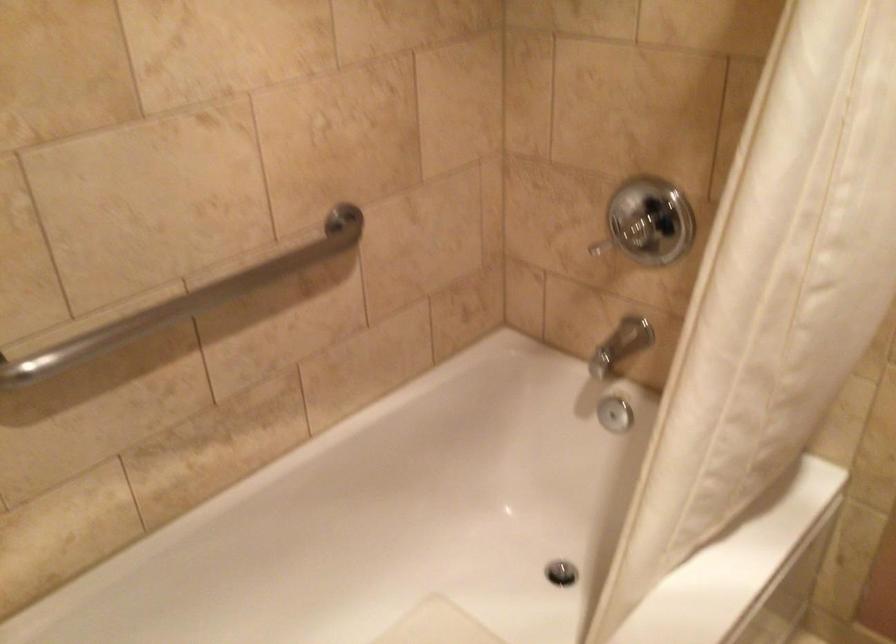
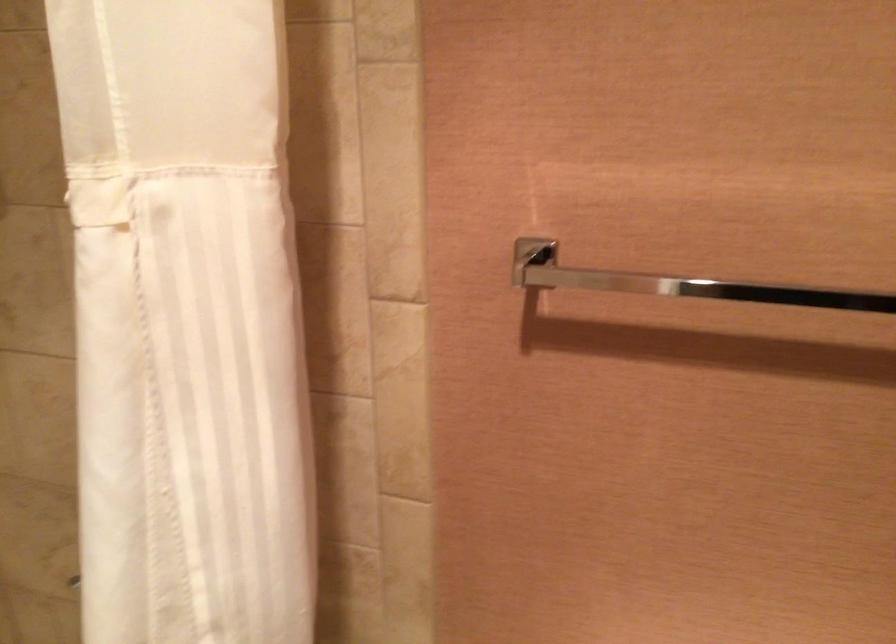
Question: The camera is either moving clockwise (left) or counter-clockwise (right) around the object. The first image is from the beginning of the video and the second image is from the end. Is the camera moving left or right when shooting the video?

Choices:
 (A) Left
 (B) Right

Answer: (A)